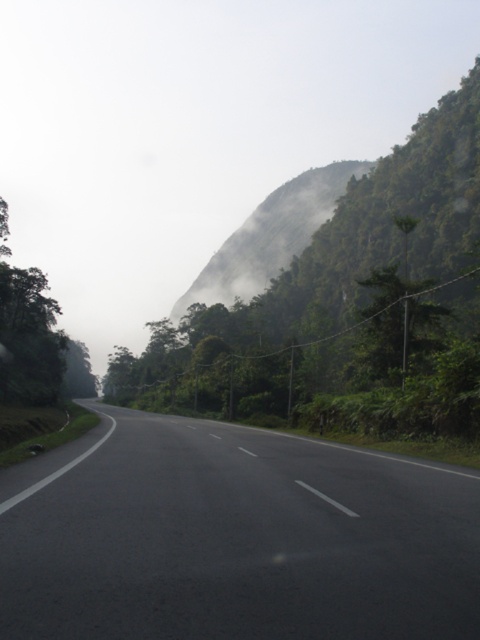
Can you confirm if green leafy mountain at upper center is positioned to the left of green leafy tree at left?

In fact, green leafy mountain at upper center is to the right of green leafy tree at left.

Is point (249, 285) positioned behind point (15, 344)?

Yes, point (249, 285) is behind point (15, 344).

Locate an element on the screen. The width and height of the screenshot is (480, 640). green leafy mountain at upper center is located at coordinates (271, 236).

Where is `green leafy mountain at upper center`? green leafy mountain at upper center is located at coordinates (271, 236).

Locate an element on the screen. This screenshot has height=640, width=480. green leafy tree at upper center is located at coordinates (340, 304).

Does point (133, 368) lie in front of point (219, 260)?

Yes.

You are a GUI agent. You are given a task and a screenshot of the screen. Output one action in this format:
    pyautogui.click(x=<x>, y=<y>)
    Task: Click on the green leafy tree at upper center
    The width and height of the screenshot is (480, 640).
    Given the screenshot: What is the action you would take?
    pyautogui.click(x=340, y=304)

Which of these two, green leafy tree at upper center or green leafy tree at left, stands shorter?

With less height is green leafy tree at left.

From the picture: Who is more forward, (389, 346) or (2, 241)?

Point (389, 346) is more forward.

At what (x,y) coordinates should I click in order to perform the action: click on green leafy tree at upper center. Please return your answer as a coordinate pair (x, y). The image size is (480, 640). Looking at the image, I should click on (340, 304).